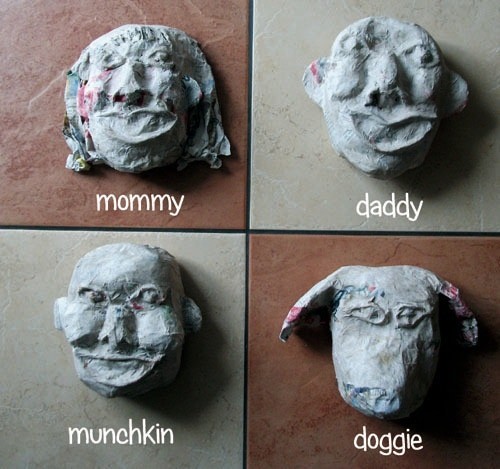
The width and height of the screenshot is (500, 469). Find the location of `dark spots in gray tile`. dark spots in gray tile is located at coordinates (273, 146), (301, 154), (317, 153).